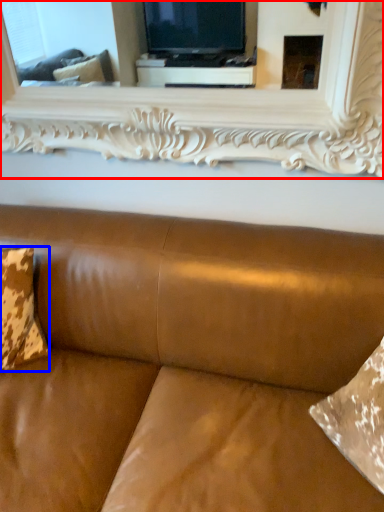
Question: Among these objects, which one is farthest to the camera, mirror (highlighted by a red box) or pillow (highlighted by a blue box)?

Choices:
 (A) mirror
 (B) pillow

Answer: (B)